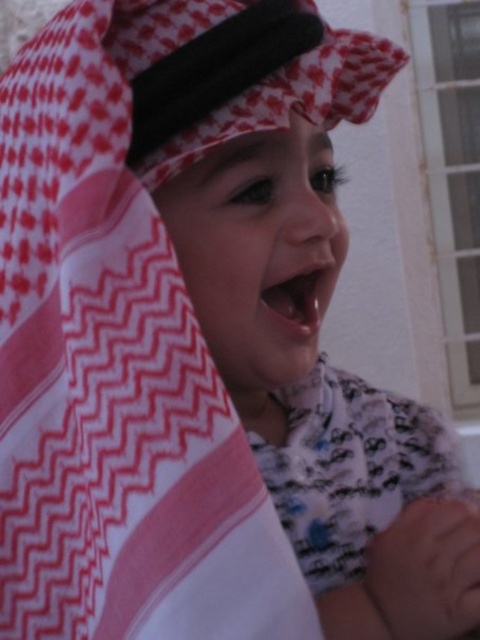
From the picture: The child in the image is wearing a keffiyeh and has a lively expression. You need to determine the spatial relationship between the white woven cloth at center and the smooth pink lips at center. Which object is positioned lower in the image?

The white woven cloth at center is positioned below the smooth pink lips at center, so the white woven cloth at center is lower.

You are a photographer taking a portrait of the child in the scene. You want to ensure the white printed robe at center and the smooth pink lips at center are both clearly visible. Which object should you focus on first to ensure proper alignment?

The smooth pink lips at center should be focused on first because the white printed robe at center is positioned on the right side of smooth pink lips at center, meaning the lips are closer to the center and require prioritization for alignment.

You are an interior designer working on a project and need to place a decorative item on the wall. The white woven cloth at center is currently at point 0.605, 0.237. Can you confirm if there is enough space to hang a picture frame that requires 0.3 meters of horizontal space next to it?

The white woven cloth at center is located at point (113,387). Since the picture frame requires 0.3 meters of horizontal space, you need to check the available space next to it. However, without knowing the total wall dimensions or the cloth size, it is unclear if there is sufficient space. Please provide more details about the wall size or the cloth dimensions for an accurate assessment.